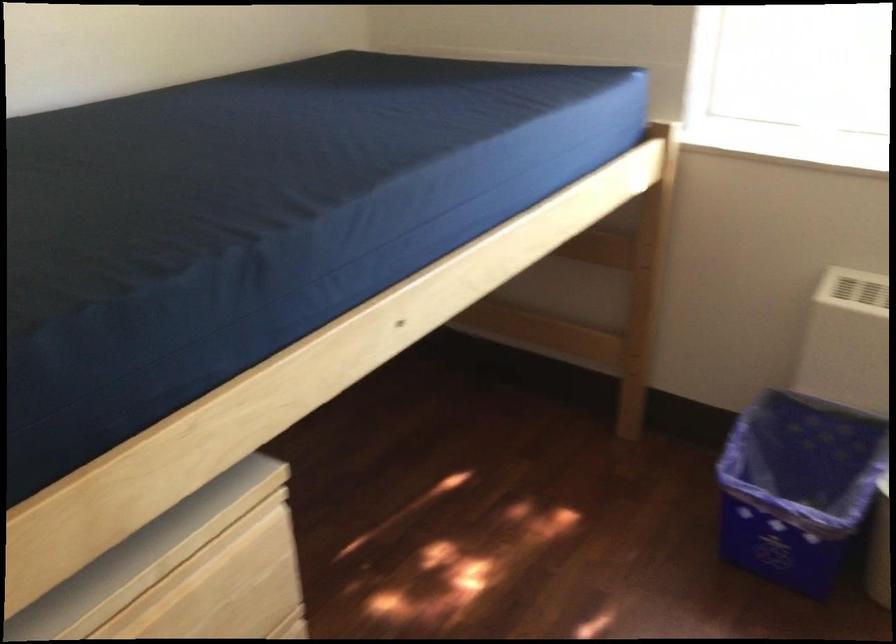
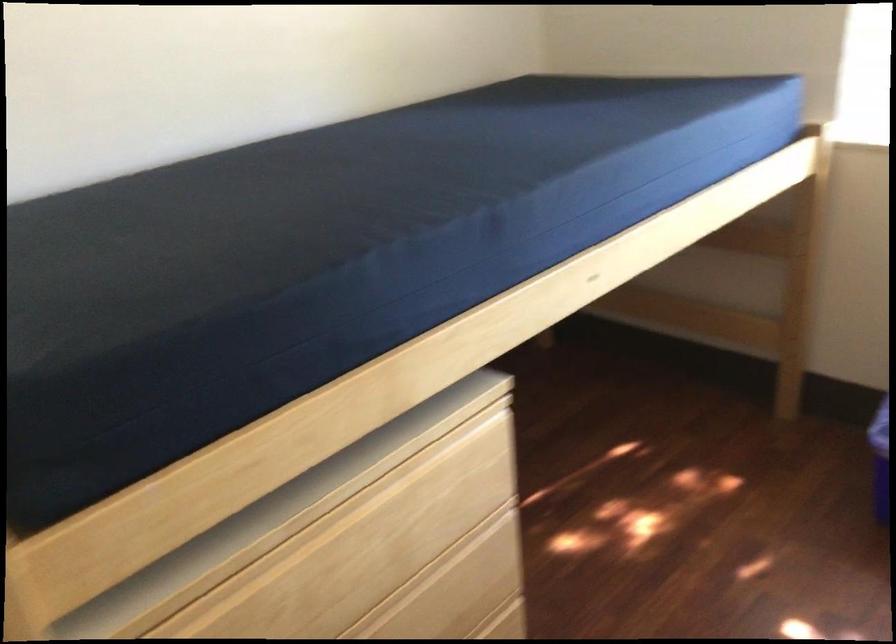
The point at [650,292] is marked in the first image. Where is the corresponding point in the second image?

(803, 275)